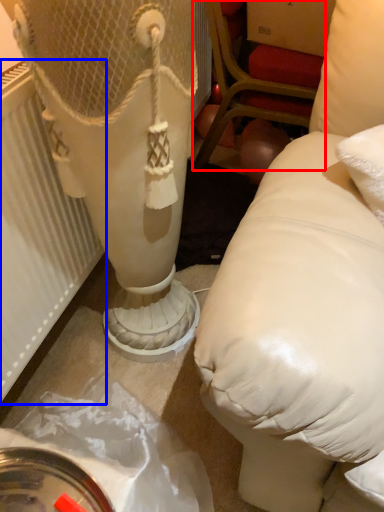
Question: Which object is closer to the camera taking this photo, furniture (highlighted by a red box) or radiator (highlighted by a blue box)?

Choices:
 (A) furniture
 (B) radiator

Answer: (B)